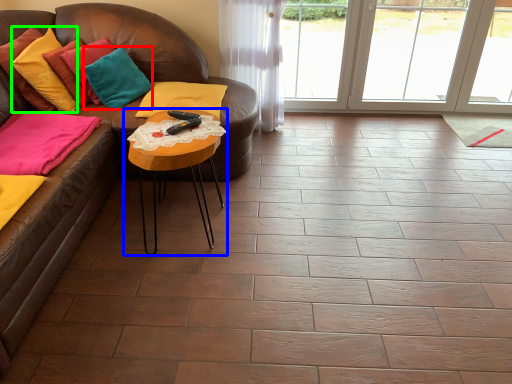
Question: Which object is the closest to the pillow (highlighted by a red box)? Choose among these: table (highlighted by a blue box) or pillow (highlighted by a green box).

Choices:
 (A) table
 (B) pillow

Answer: (B)